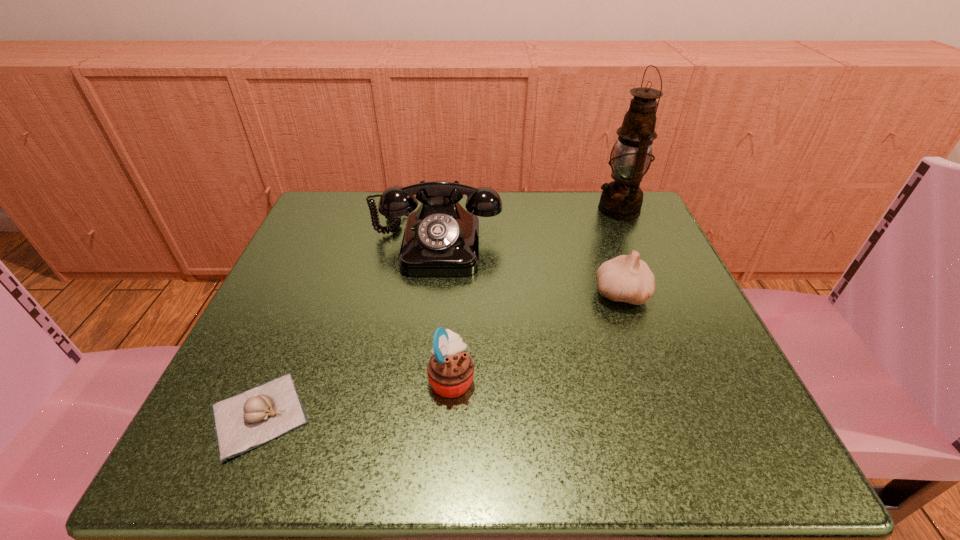
Where is `the tallest object`? The image size is (960, 540). the tallest object is located at coordinates (622, 199).

Image resolution: width=960 pixels, height=540 pixels. What are the coordinates of `the second tallest object` in the screenshot? It's located at (441, 238).

Where is `muffin`? muffin is located at coordinates [450, 370].

Identify the location of the farther garlic. The image size is (960, 540). (624, 278).

The image size is (960, 540). In order to click on the right garlic in this screenshot , I will do `click(624, 278)`.

The height and width of the screenshot is (540, 960). Find the location of `the shorter garlic`. the shorter garlic is located at coordinates (242, 422).

Where is `the leftmost object`? The height and width of the screenshot is (540, 960). the leftmost object is located at coordinates (242, 422).

In order to click on blank area located 0.130m on the front of the oil lamp in this screenshot , I will do `click(643, 265)`.

Where is `free spot located on the dial of the fourth shortest object`? This screenshot has width=960, height=540. free spot located on the dial of the fourth shortest object is located at coordinates (410, 457).

Locate an element on the screen. vacant space located on the front-facing side of the muffin is located at coordinates (698, 379).